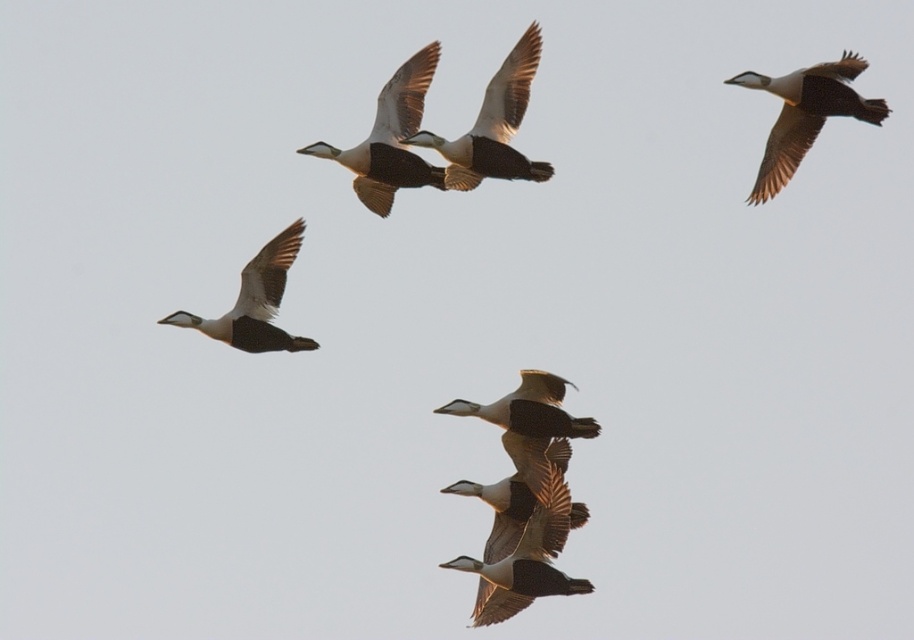
Can you confirm if white-feathered duck at upper right is thinner than white matte goose at left?

No, white-feathered duck at upper right is not thinner than white matte goose at left.

Between white-feathered duck at upper right and white matte goose at left, which one has more height?

white-feathered duck at upper right is taller.

What do you see at coordinates (805, 115) in the screenshot? The image size is (914, 640). I see `white-feathered duck at upper right` at bounding box center [805, 115].

Where is `white-feathered duck at upper right`? The height and width of the screenshot is (640, 914). white-feathered duck at upper right is located at coordinates (805, 115).

Measure the distance between white-feathered duck at center and camera.

white-feathered duck at center and camera are 423.77 feet apart from each other.

Who is positioned more to the left, white-feathered duck at center or white glossy duck at center?

Positioned to the left is white-feathered duck at center.

Identify the location of white-feathered duck at center. This screenshot has height=640, width=914. (493, 125).

In order to click on white-feathered duck at center in this screenshot , I will do `click(493, 125)`.

Is white glossy goose at upper center above white glossy duck at center?

Yes.

Which is behind, point (379, 145) or point (545, 404)?

The point (379, 145) is behind.

The image size is (914, 640). I want to click on white glossy goose at upper center, so click(x=390, y=138).